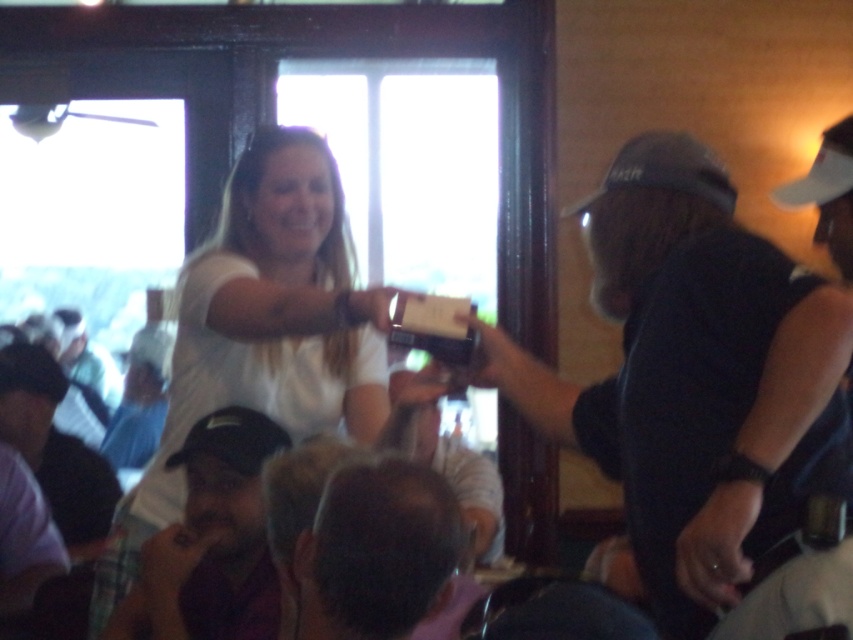
Describe the element at coordinates (262, 332) in the screenshot. I see `white matte shirt at center` at that location.

Between white matte shirt at center and white fabric baseball cap at upper right, which one has less height?

With less height is white fabric baseball cap at upper right.

The image size is (853, 640). Describe the element at coordinates (262, 332) in the screenshot. I see `white matte shirt at center` at that location.

Identify the location of white matte shirt at center. This screenshot has width=853, height=640. (262, 332).

Is point (134, 550) positioned behind point (660, 168)?

Yes, point (134, 550) is farther from viewer.

Can you confirm if white matte shirt at center is shorter than black fabric baseball hat at upper right?

No.

Between point (259, 291) and point (666, 131), which one is positioned behind?

The point (666, 131) is behind.

At what (x,y) coordinates should I click in order to perform the action: click on white matte shirt at center. Please return your answer as a coordinate pair (x, y). Image resolution: width=853 pixels, height=640 pixels. Looking at the image, I should click on (262, 332).

Is point (700, 432) less distant than point (686, 134)?

Yes, it is in front of point (686, 134).

Between point (799, 566) and point (612, 161), which one is positioned in front?

Point (799, 566)

Identify the location of dark gray cap at center. The height and width of the screenshot is (640, 853). (701, 394).